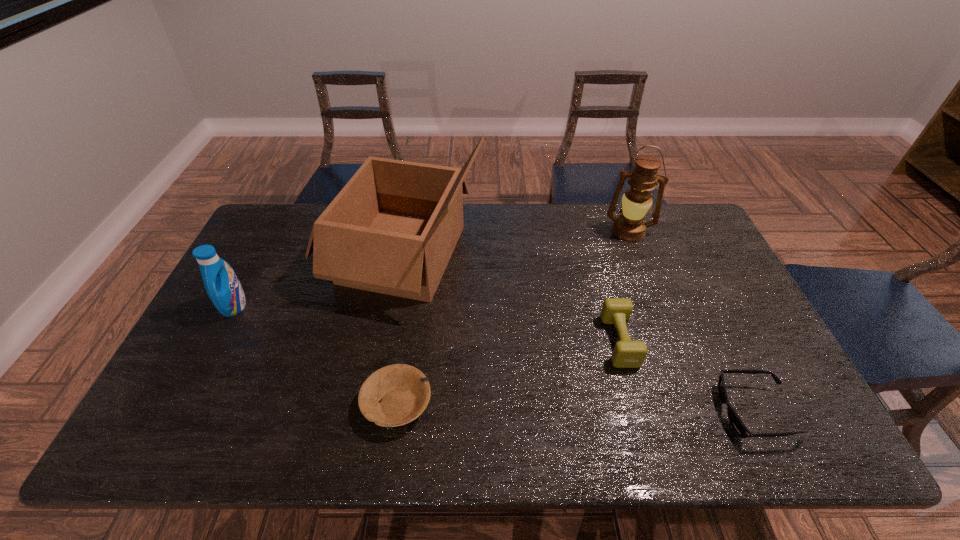
Choose which object is the second nearest neighbor to the sunglasses. Please provide its 2D coordinates. Your answer should be formatted as a tuple, i.e. [(x, y)], where the tuple contains the x and y coordinates of a point satisfying the conditions above.

[(630, 226)]

Locate an element on the screen. vacant space that satisfies the following two spatial constraints: 1. on the front-facing side of the fourth shortest object; 2. on the back side of the fourth object from left to right is located at coordinates (217, 341).

Where is `free space that satisfies the following two spatial constraints: 1. on the front-facing side of the bowl; 2. on the left side of the detergent`? free space that satisfies the following two spatial constraints: 1. on the front-facing side of the bowl; 2. on the left side of the detergent is located at coordinates (183, 404).

Where is `vacant space that satisfies the following two spatial constraints: 1. on the front-facing side of the bowl; 2. on the right side of the fourth shortest object`? The image size is (960, 540). vacant space that satisfies the following two spatial constraints: 1. on the front-facing side of the bowl; 2. on the right side of the fourth shortest object is located at coordinates (183, 404).